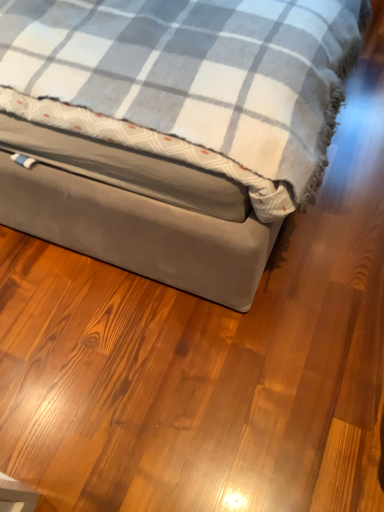
What is the approximate width of suede-like gray bed at center?

5.29 feet.

Image resolution: width=384 pixels, height=512 pixels. Describe the element at coordinates (169, 133) in the screenshot. I see `suede-like gray bed at center` at that location.

The width and height of the screenshot is (384, 512). I want to click on suede-like gray bed at center, so click(169, 133).

At what (x,y) coordinates should I click in order to perform the action: click on suede-like gray bed at center. Please return your answer as a coordinate pair (x, y). Looking at the image, I should click on (169, 133).